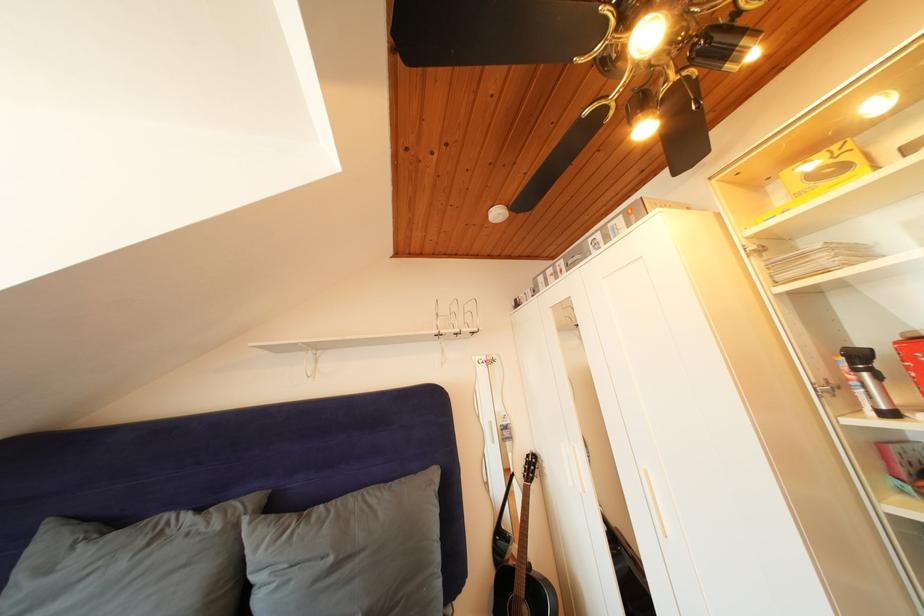
Where is `white cabinet handle`? white cabinet handle is located at coordinates (845, 398).